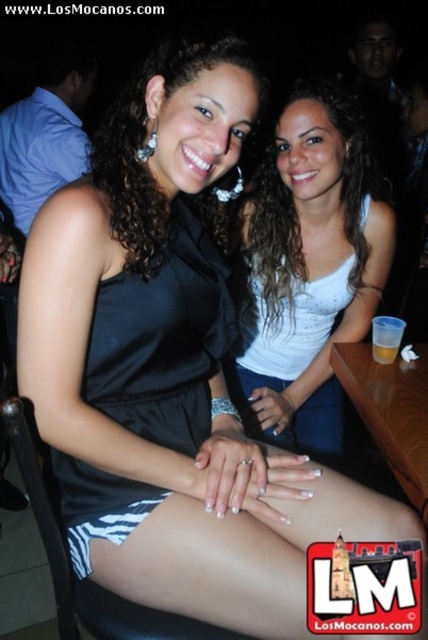
Question: Based on their relative distances, which object is nearer to the translucent plastic cup at center?

Choices:
 (A) black satin dress at center
 (B) white glittery tank top at center

Answer: (B)

Question: Which point is farther from the camera taking this photo?

Choices:
 (A) (395, 353)
 (B) (204, 273)
 (C) (324, 317)

Answer: (C)

Question: Is black satin dress at center smaller than translucent plastic cup at center?

Choices:
 (A) no
 (B) yes

Answer: (A)

Question: Is black satin dress at center smaller than translucent plastic cup at center?

Choices:
 (A) yes
 (B) no

Answer: (B)

Question: Does white glittery tank top at center appear under black satin dress at center?

Choices:
 (A) yes
 (B) no

Answer: (B)

Question: Considering the real-world distances, which object is farthest from the white glittery tank top at center?

Choices:
 (A) black satin dress at center
 (B) translucent plastic cup at center

Answer: (A)